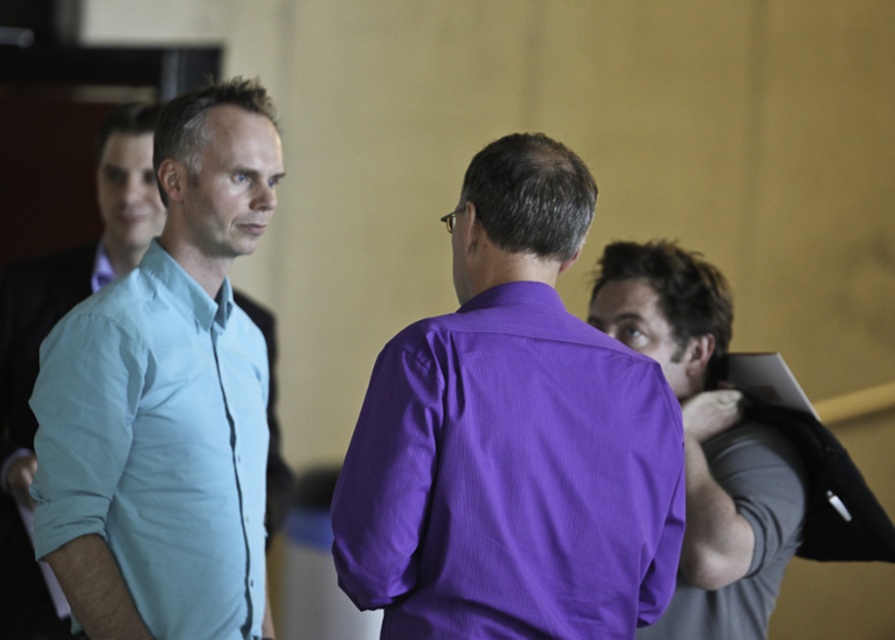
Question: Which point is closer to the camera taking this photo?

Choices:
 (A) (581, 572)
 (B) (684, 396)

Answer: (A)

Question: Is purple smooth shirt at center thinner than purple smooth shirt at right?

Choices:
 (A) yes
 (B) no

Answer: (B)

Question: Can you confirm if light blue cotton shirt at left is bigger than purple smooth shirt at right?

Choices:
 (A) yes
 (B) no

Answer: (B)

Question: Which is nearer to the purple smooth shirt at center?

Choices:
 (A) light blue cotton shirt at left
 (B) purple smooth shirt at right

Answer: (A)

Question: Is light blue cotton shirt at left wider than purple smooth shirt at right?

Choices:
 (A) no
 (B) yes

Answer: (A)

Question: Which point is closer to the camera?

Choices:
 (A) light blue cotton shirt at left
 (B) purple smooth shirt at center

Answer: (B)